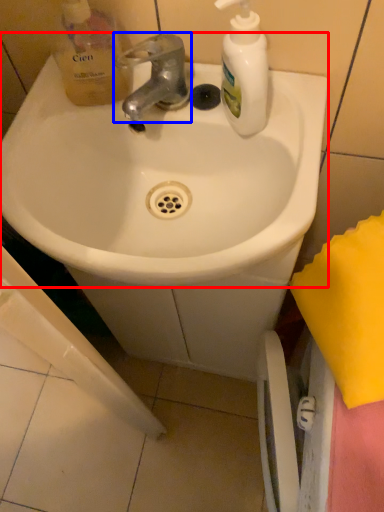
Question: Which object is further to the camera taking this photo, sink (highlighted by a red box) or tap (highlighted by a blue box)?

Choices:
 (A) sink
 (B) tap

Answer: (B)